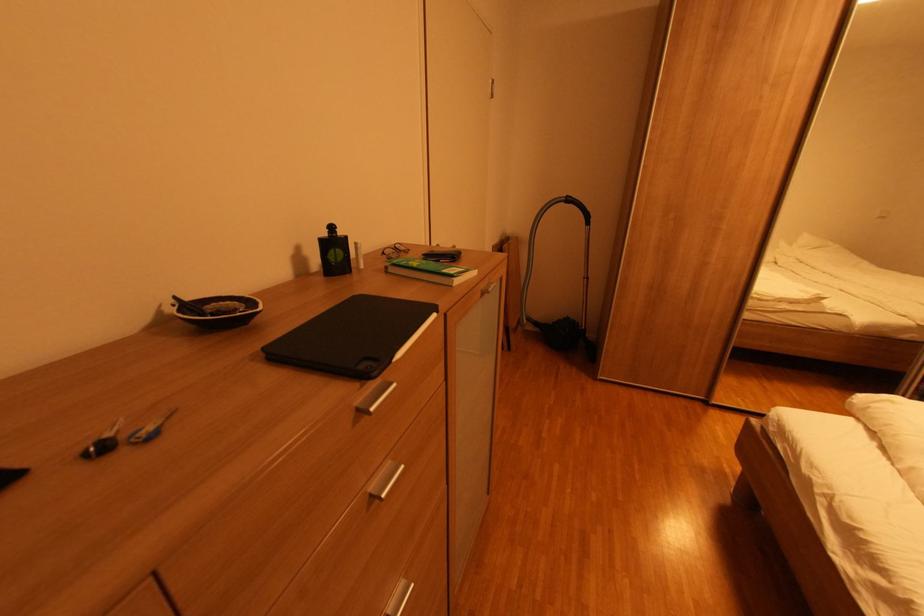
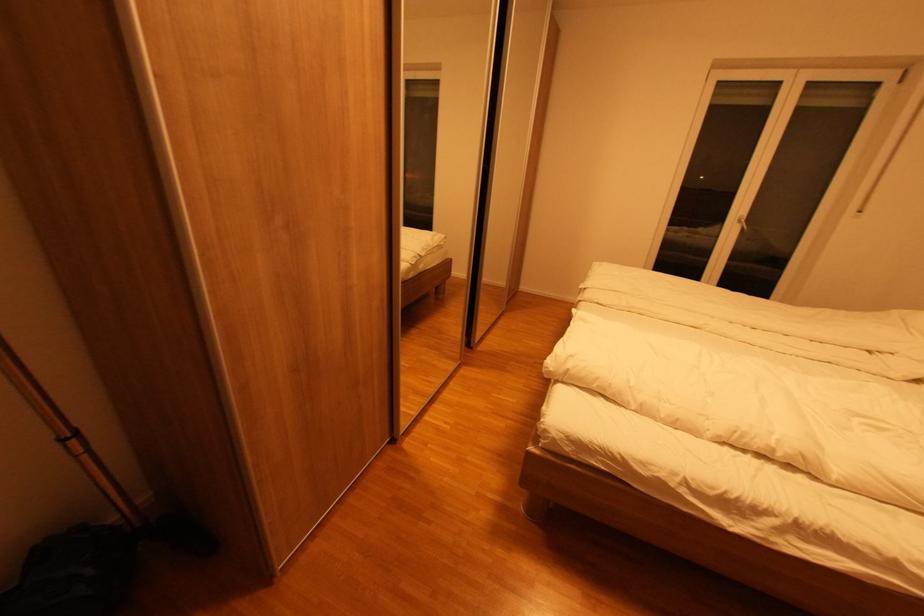
Locate, in the second image, the point that corresponds to (593,280) in the first image.

(83, 434)